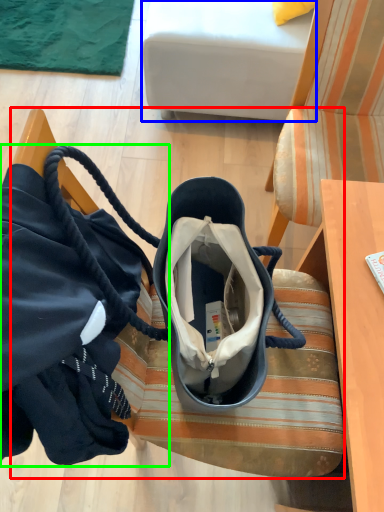
Question: Estimate the real-world distances between objects in this image. Which object is closer to furniture (highlighted by a red box), studio couch (highlighted by a blue box) or handbag (highlighted by a green box)?

Choices:
 (A) studio couch
 (B) handbag

Answer: (B)